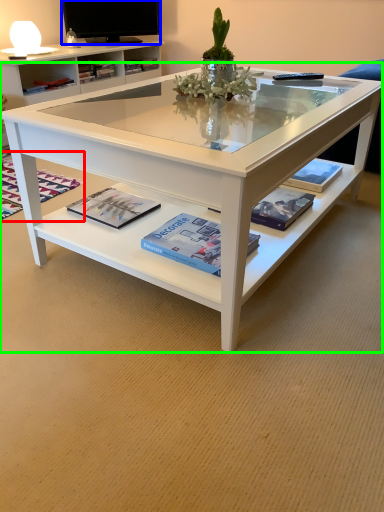
Question: Which object is positioned closest to magazine (highlighted by a red box)? Select from television (highlighted by a blue box) and coffee table (highlighted by a green box).

Choices:
 (A) television
 (B) coffee table

Answer: (B)